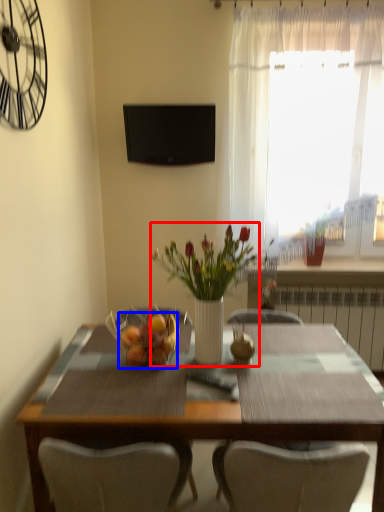
Question: Which of the following is the closest to the observer, floral arrangement (highlighted by a red box) or fruit dish (highlighted by a blue box)?

Choices:
 (A) floral arrangement
 (B) fruit dish

Answer: (A)